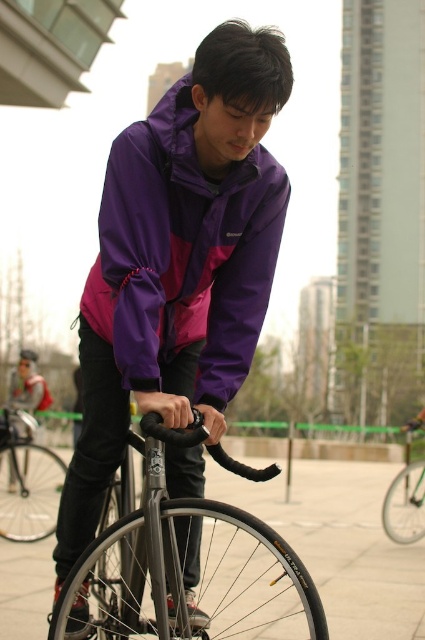
Question: Which point appears closest to the camera in this image?

Choices:
 (A) (10, 484)
 (B) (413, 460)

Answer: (A)

Question: Is purple matte jacket at center closer to camera compared to matte black jacket at center?

Choices:
 (A) yes
 (B) no

Answer: (A)

Question: Which object is the closest to the matte black jacket at center?

Choices:
 (A) purple matte jacket at center
 (B) shiny black frame at center
 (C) purple/matte jacket at center
 (D) shiny silver bicycle at center

Answer: (D)

Question: Can you confirm if shiny silver bicycle at center is smaller than matte black jacket at center?

Choices:
 (A) no
 (B) yes

Answer: (B)

Question: Which object is closer to the camera taking this photo?

Choices:
 (A) matte black jacket at center
 (B) shiny metallic bicycle at lower left
 (C) shiny black frame at center
 (D) purple matte jacket at center

Answer: (D)

Question: Does purple/matte jacket at center appear on the right side of matte black jacket at center?

Choices:
 (A) no
 (B) yes

Answer: (B)